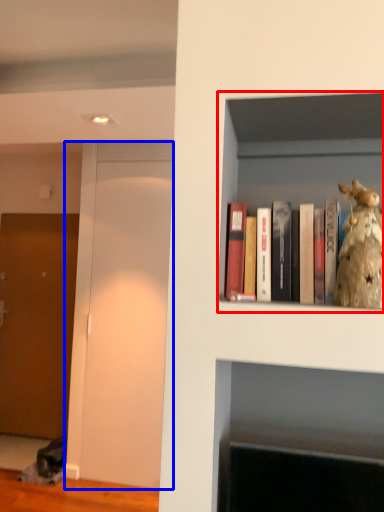
Question: Which of the following is the farthest to the observer, shelf (highlighted by a red box) or glass door (highlighted by a blue box)?

Choices:
 (A) shelf
 (B) glass door

Answer: (B)